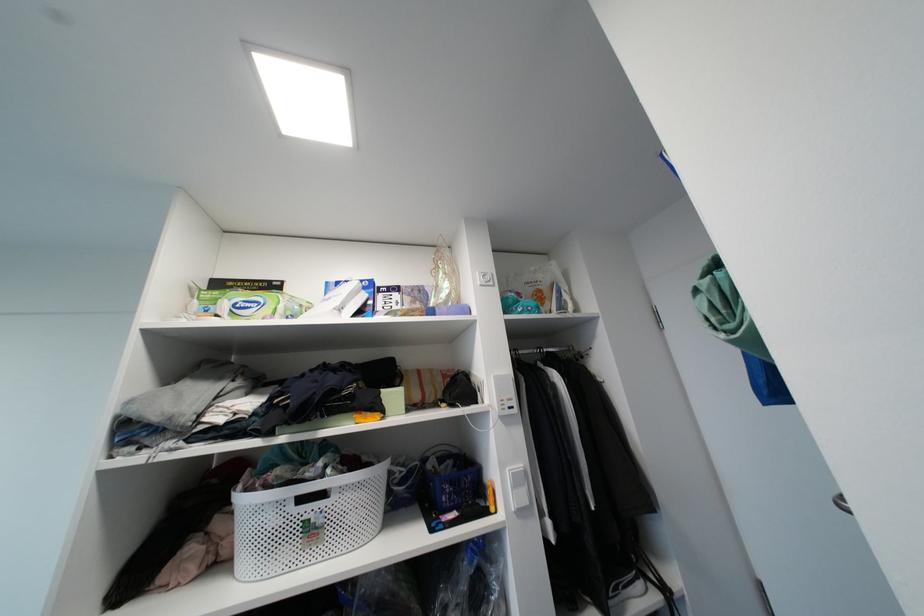
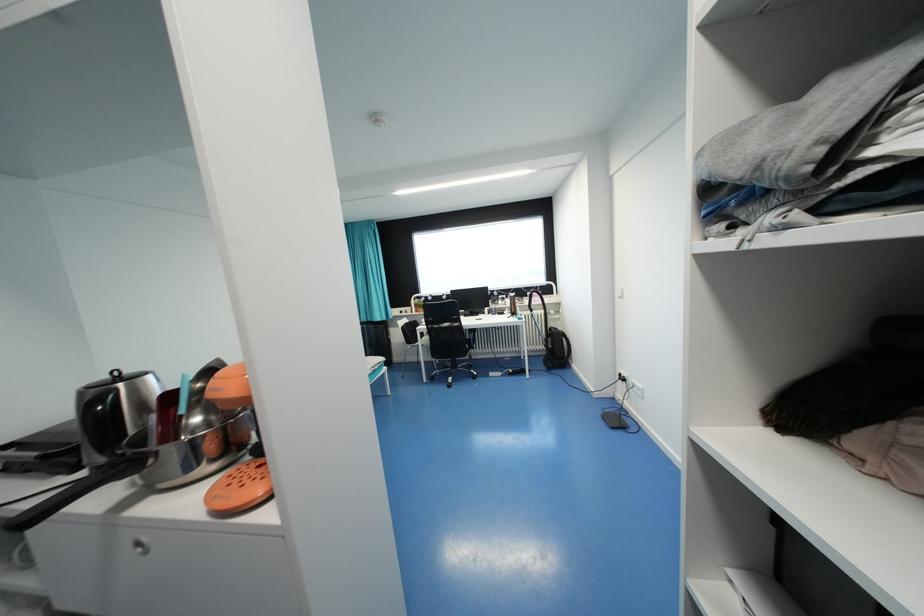
Question: The first image is from the beginning of the video and the second image is from the end. How did the camera likely rotate when shooting the video?

Choices:
 (A) Left
 (B) Right
 (C) Up
 (D) Down

Answer: (A)